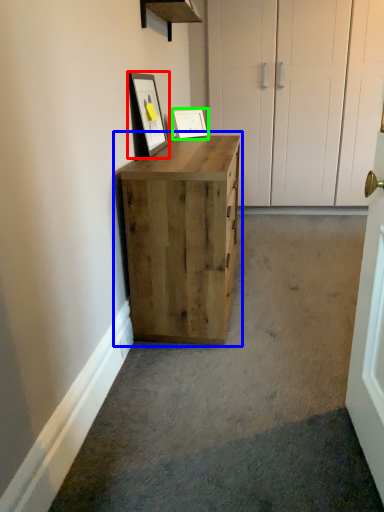
Question: Estimate the real-world distances between objects in this image. Which object is farther from picture frame (highlighted by a red box), chest of drawers (highlighted by a blue box) or picture frame (highlighted by a green box)?

Choices:
 (A) chest of drawers
 (B) picture frame

Answer: (A)